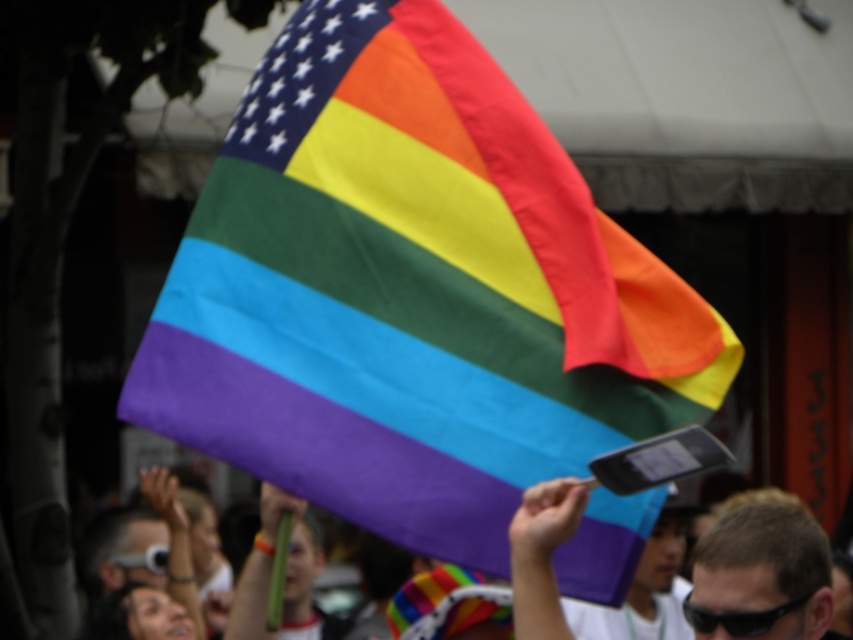
Is rainbow fabric flag at upper center positioned in front of short brown hair at center?

Yes, it is in front of short brown hair at center.

Identify the location of rainbow fabric flag at upper center. The image size is (853, 640). (412, 292).

Is point (418, 500) positioned in front of point (816, 609)?

Yes.

The height and width of the screenshot is (640, 853). I want to click on rainbow fabric flag at upper center, so click(412, 292).

Image resolution: width=853 pixels, height=640 pixels. What do you see at coordinates (761, 576) in the screenshot? I see `short brown hair at center` at bounding box center [761, 576].

Does short brown hair at center have a lesser width compared to black plastic goggles at upper center?

No.

Describe the element at coordinates (761, 576) in the screenshot. I see `short brown hair at center` at that location.

I want to click on short brown hair at center, so click(761, 576).

Is point (155, 381) farther from camera compared to point (686, 605)?

No, (155, 381) is in front of (686, 605).

Is rainbow fabric flag at upper center behind black plastic goggles at upper center?

No, it is not.

The width and height of the screenshot is (853, 640). Identify the location of rainbow fabric flag at upper center. (412, 292).